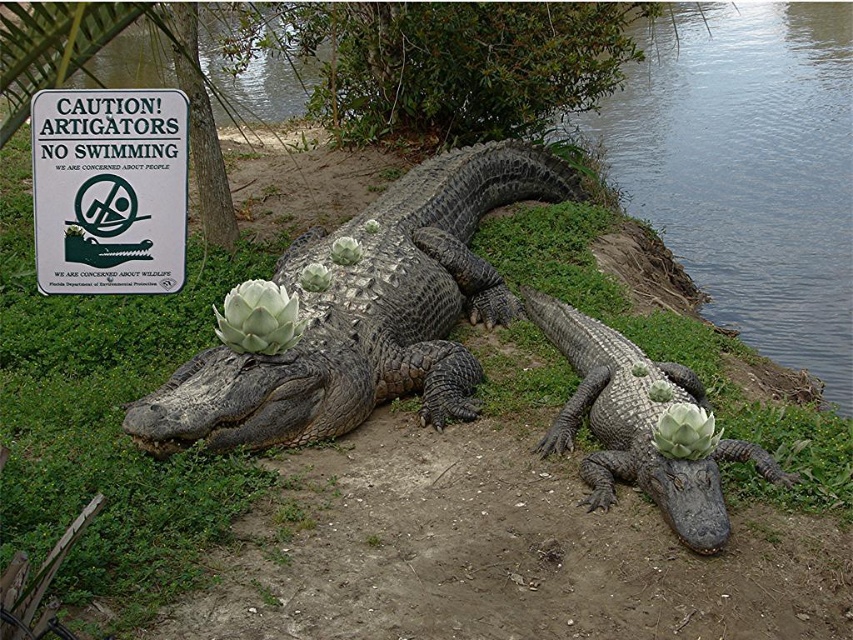
Question: Which of the following is the farthest from the observer?

Choices:
 (A) (45, 212)
 (B) (705, 204)
 (C) (332, 236)

Answer: (B)

Question: Can you confirm if white paper sign at upper left is wider than matte gray crocodile at center?

Choices:
 (A) no
 (B) yes

Answer: (A)

Question: Estimate the real-world distances between objects in this image. Which object is farther from the dark gray textured crocodile at center?

Choices:
 (A) matte gray crocodile at center
 (B) clear water at lower right
 (C) white paper sign at upper left

Answer: (B)

Question: Is clear water at lower right in front of dark gray textured crocodile at center?

Choices:
 (A) no
 (B) yes

Answer: (A)

Question: Observing the image, what is the correct spatial positioning of clear water at lower right in reference to dark gray textured crocodile at center?

Choices:
 (A) right
 (B) left

Answer: (A)

Question: Estimate the real-world distances between objects in this image. Which object is farther from the matte gray crocodile at center?

Choices:
 (A) white paper sign at upper left
 (B) dark gray textured crocodile at center

Answer: (A)